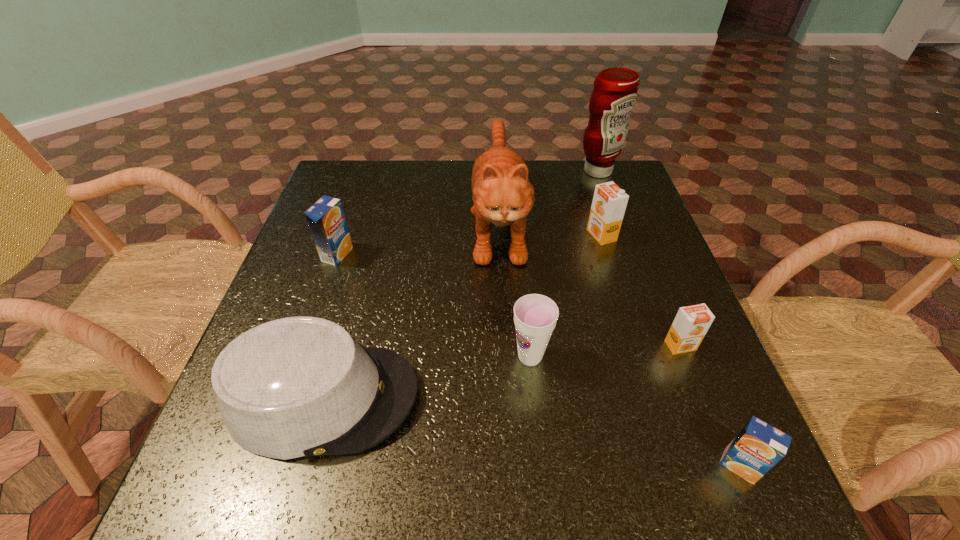
Locate an element on the screen. The height and width of the screenshot is (540, 960). red condiment is located at coordinates (614, 95).

Find the location of a particular element. Image resolution: width=960 pixels, height=540 pixels. cat is located at coordinates (502, 194).

Identify the location of the leftmost orange juice. point(326,219).

The image size is (960, 540). I want to click on the farther blue orange_juice, so click(326, 219).

Locate an element on the screen. The height and width of the screenshot is (540, 960). the third orange juice from right to left is located at coordinates (609, 202).

The width and height of the screenshot is (960, 540). What are the coordinates of `the bigger orange orange juice` in the screenshot? It's located at pos(609,202).

Image resolution: width=960 pixels, height=540 pixels. In order to click on purple cup in this screenshot , I will do `click(535, 316)`.

You are a GUI agent. You are given a task and a screenshot of the screen. Output one action in this format:
    pyautogui.click(x=<x>, y=<y>)
    Task: Click on the hat
    The image size is (960, 540).
    Given the screenshot: What is the action you would take?
    pyautogui.click(x=296, y=387)

Locate an element on the screen. the right blue orange_juice is located at coordinates (759, 446).

Where is `the nearer blue orange_juice`? The height and width of the screenshot is (540, 960). the nearer blue orange_juice is located at coordinates (759, 446).